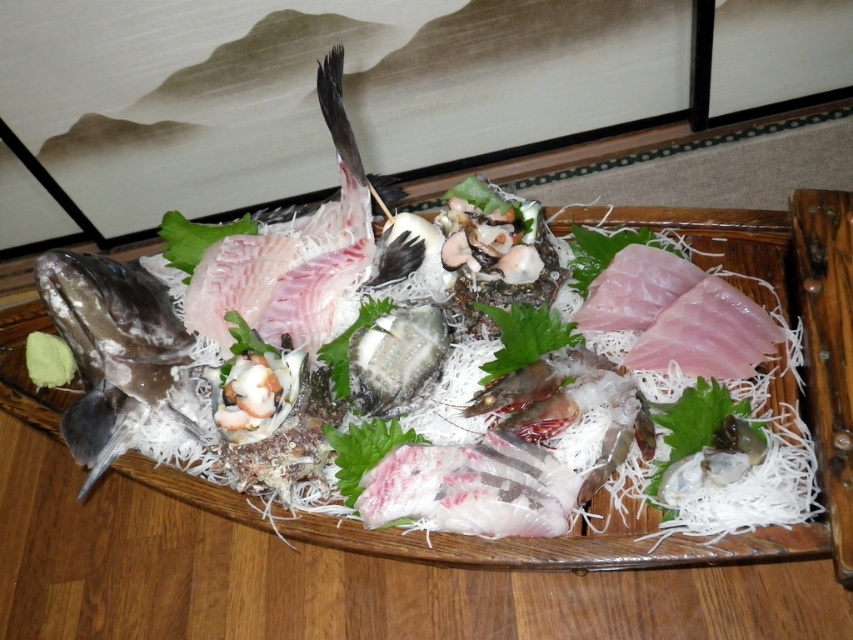
You are a food critic examining the sashimi platter. You notice a point at coordinates (587, 541). What type of food item is located at this point?

The point at (587, 541) has pinkish white fish at center.